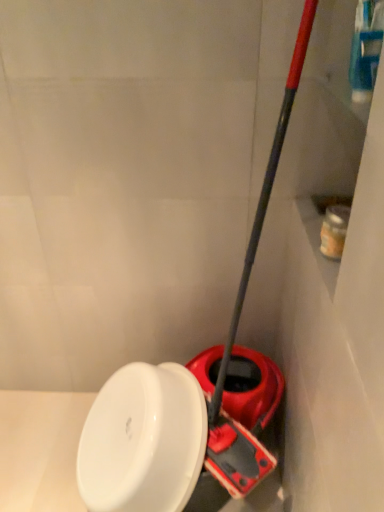
Measure the distance between red plastic shovel at center and camera.

The distance of red plastic shovel at center from camera is 32.82 inches.

This screenshot has width=384, height=512. I want to click on red plastic shovel at center, so click(238, 323).

What do you see at coordinates (238, 323) in the screenshot? I see `red plastic shovel at center` at bounding box center [238, 323].

Find the location of a particular element. red plastic shovel at center is located at coordinates (238, 323).